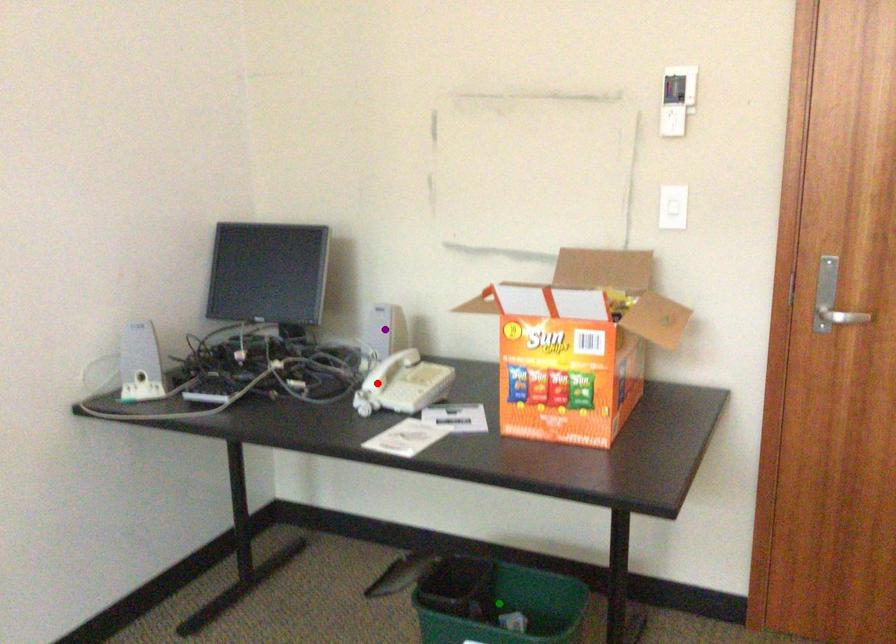
Order these from nearest to farthest:
purple point, green point, red point

green point
red point
purple point